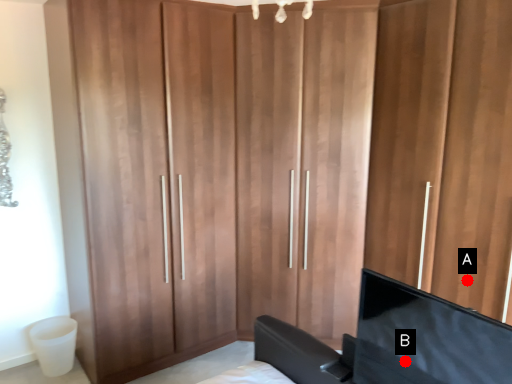
Question: Two points are circled on the image, labeled by A and B beside each circle. Which point appears farthest from the camera in this image?

Choices:
 (A) A is further
 (B) B is further

Answer: (A)